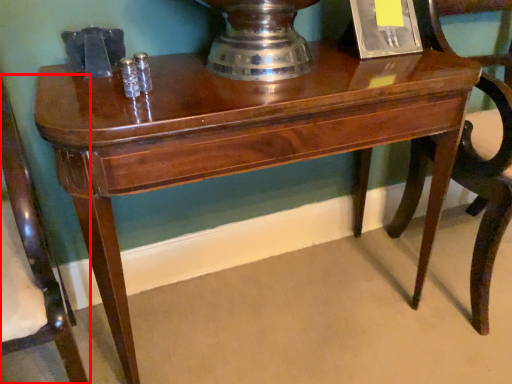
Question: From the image's perspective, where is chair (annotated by the red box) located in relation to chair in the image?

Choices:
 (A) below
 (B) above

Answer: (A)